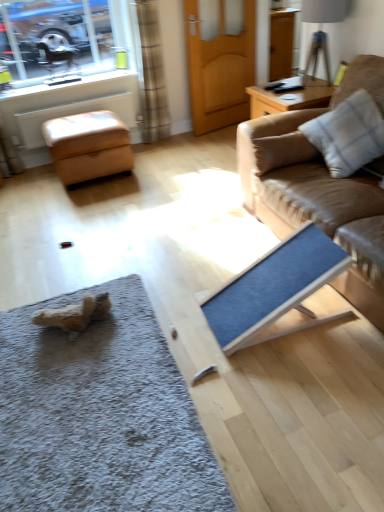
The height and width of the screenshot is (512, 384). What are the coordinates of `wooden cabinet at upper center` in the screenshot? It's located at (281, 42).

Looking at this image, in order to face wooden door at center, should I rotate leftwards or rightwards?

Turn right approximately 4.605 degrees to face it.

Describe the element at coordinates (100, 415) in the screenshot. I see `gray shaggy doormat at lower left` at that location.

Where is `matte brown armchair at upper left`? This screenshot has height=512, width=384. matte brown armchair at upper left is located at coordinates (57, 57).

Describe the element at coordinates (348, 134) in the screenshot. I see `white checkered fabric pillow on the right` at that location.

Find the location of a particular element. The width and height of the screenshot is (384, 512). wooden cabinet at upper center is located at coordinates [281, 42].

Does leather ottoman at left have a lesser height compared to leather couch at right?

Yes.

From a real-world perspective, does leather ottoman at left stand above leather couch at right?

No, from a real-world perspective, leather ottoman at left is not over leather couch at right

Is leather ottoman at left behind leather couch at right?

Yes, it is behind leather couch at right.

Is leather ottoman at left not inside leather couch at right?

leather ottoman at left is positioned outside leather couch at right.

Is point (44, 48) positioned behind point (97, 149)?

Yes, it is.

Does matte brown armchair at upper left have a lesser height compared to leather ottoman at left?

Correct, matte brown armchair at upper left is not as tall as leather ottoman at left.

From a real-world perspective, is matte brown armchair at upper left physically above leather ottoman at left?

Correct, in the physical world, matte brown armchair at upper left is higher than leather ottoman at left.

Does matte brown armchair at upper left contain leather ottoman at left?

Definitely not — leather ottoman at left is not inside matte brown armchair at upper left.

From a real-world perspective, relative to matte brown armchair at upper left, is gray shaggy doormat at lower left vertically above or below?

From a real-world perspective, gray shaggy doormat at lower left is physically below matte brown armchair at upper left.

Is gray shaggy doormat at lower left completely or partially outside of matte brown armchair at upper left?

gray shaggy doormat at lower left lies outside matte brown armchair at upper left's area.

In terms of height, does gray shaggy doormat at lower left look taller or shorter compared to matte brown armchair at upper left?

Considering their sizes, gray shaggy doormat at lower left has less height than matte brown armchair at upper left.

Does point (147, 413) appear closer or farther from the camera than point (56, 51)?

Point (147, 413) appears to be closer to the viewer than point (56, 51).

Is blue fabric yoga mat at center inside wooden cabinet at upper center?

Actually, blue fabric yoga mat at center is outside wooden cabinet at upper center.

From a real-world perspective, which is physically above, wooden cabinet at upper center or blue fabric yoga mat at center?

In real-world perspective, wooden cabinet at upper center is above.

Considering the relative sizes of wooden cabinet at upper center and blue fabric yoga mat at center in the image provided, is wooden cabinet at upper center bigger than blue fabric yoga mat at center?

Yes.

Is leather couch at right to the right of blue fabric yoga mat at center from the viewer's perspective?

Yes, leather couch at right is to the right of blue fabric yoga mat at center.

From a real-world perspective, is leather couch at right located higher than blue fabric yoga mat at center?

Yes.

Find the location of a particular element. Image resolution: width=384 pixels, height=512 pixels. studio couch above the blue fabric yoga mat at center (from the image's perspective) is located at coordinates (320, 188).

Considering the sizes of objects leather couch at right and blue fabric yoga mat at center in the image provided, who is smaller, leather couch at right or blue fabric yoga mat at center?

With smaller size is blue fabric yoga mat at center.

Considering the relative sizes of matte brown armchair at upper left and leather couch at right in the image provided, is matte brown armchair at upper left thinner than leather couch at right?

Correct, the width of matte brown armchair at upper left is less than that of leather couch at right.

What's the angular difference between matte brown armchair at upper left and leather couch at right's facing directions?

matte brown armchair at upper left and leather couch at right are facing 87.9 degrees away from each other.

Considering the relative sizes of matte brown armchair at upper left and leather couch at right in the image provided, is matte brown armchair at upper left smaller than leather couch at right?

Yes, matte brown armchair at upper left is smaller than leather couch at right.

Which point is more distant from viewer, (57, 56) or (348, 209)?

The point (57, 56) is more distant.

Is gray shaggy doormat at lower left taller or shorter than brown textured curtain at upper left?

Clearly, gray shaggy doormat at lower left is shorter compared to brown textured curtain at upper left.

Which is more to the right, gray shaggy doormat at lower left or brown textured curtain at upper left?

brown textured curtain at upper left.

Considering the points (132, 496) and (157, 120), which point is in front, point (132, 496) or point (157, 120)?

The point (132, 496) is closer.

Is gray shaggy doormat at lower left not inside brown textured curtain at upper left?

Yes, gray shaggy doormat at lower left is located beyond the bounds of brown textured curtain at upper left.

This screenshot has height=512, width=384. In order to click on studio couch below the leather ottoman at left (from the image's perspective) in this screenshot , I will do `click(320, 188)`.

Identify the location of stool in front of the matte brown armchair at upper left. This screenshot has width=384, height=512. (88, 146).

Looking at the image, which one is located closer to gray shaggy doormat at lower left, blue fabric yoga mat at center or wooden cabinet at upper center?

Based on the image, blue fabric yoga mat at center appears to be nearer to gray shaggy doormat at lower left.

When comparing their distances from wooden door at center, does clear glass window at upper left or white checkered fabric pillow on the right seem further?

white checkered fabric pillow on the right lies further to wooden door at center than the other object.

Based on their spatial positions, is brown textured curtain at upper left or blue fabric yoga mat at center closer to leather couch at right?

blue fabric yoga mat at center.

Looking at the image, which one is located further to leather ottoman at left, white checkered fabric pillow on the right or clear glass window at upper left?

Based on the image, white checkered fabric pillow on the right appears to be further to leather ottoman at left.

Looking at the image, which one is located further to leather ottoman at left, leather couch at right or gray shaggy doormat at lower left?

gray shaggy doormat at lower left.

Estimate the real-world distances between objects in this image. Which object is further from gray shaggy doormat at lower left, white checkered fabric pillow on the right or clear glass window at upper left?

Based on the image, clear glass window at upper left appears to be further to gray shaggy doormat at lower left.

From the image, which object appears to be farther from leather ottoman at left, wooden cabinet at upper center or leather couch at right?

wooden cabinet at upper center is further to leather ottoman at left.

Which object lies nearer to the anchor point clear glass window at upper left, brown textured curtain at upper left or gray shaggy doormat at lower left?

The object closer to clear glass window at upper left is brown textured curtain at upper left.

Locate an element on the screen. curtain located between clear glass window at upper left and white checkered fabric pillow on the right in the left-right direction is located at coordinates (150, 73).

I want to click on lamp that lies between brown textured curtain at upper left and blue fabric yoga mat at center from top to bottom, so click(x=325, y=11).

Locate an element on the screen. Image resolution: width=384 pixels, height=512 pixels. yoga mat situated between clear glass window at upper left and leather couch at right from left to right is located at coordinates (x=275, y=287).

Locate an element on the screen. door between brown textured curtain at upper left and wooden cabinet at upper center in the front-back direction is located at coordinates (219, 69).